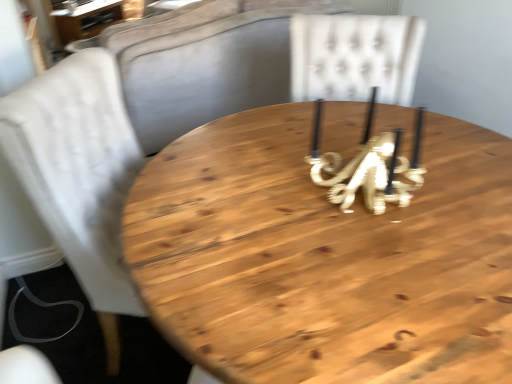
Question: Would you say white fabric chair at left is part of natural wood table at center, which ranks as the 2th table in left-to-right order,'s contents?

Choices:
 (A) no
 (B) yes

Answer: (A)

Question: Considering the relative positions of natural wood table at center, which is the first table from right to left, and white fabric chair at left in the image provided, is natural wood table at center, which is the first table from right to left, behind white fabric chair at left?

Choices:
 (A) no
 (B) yes

Answer: (A)

Question: Does natural wood table at center, arranged as the 2th table when viewed from the back, have a smaller size compared to white fabric chair at left?

Choices:
 (A) yes
 (B) no

Answer: (A)

Question: Considering the relative positions of natural wood table at center, which appears as the 1th table when ordered from the bottom, and white fabric chair at left in the image provided, is natural wood table at center, which appears as the 1th table when ordered from the bottom, to the right of white fabric chair at left from the viewer's perspective?

Choices:
 (A) no
 (B) yes

Answer: (B)

Question: Considering the relative sizes of natural wood table at center, which ranks as the 2th table in left-to-right order, and white fabric chair at left in the image provided, is natural wood table at center, which ranks as the 2th table in left-to-right order, taller than white fabric chair at left?

Choices:
 (A) no
 (B) yes

Answer: (B)

Question: Can we say natural wood table at center, which is the second table in top-to-bottom order, lies outside white fabric chair at left?

Choices:
 (A) no
 (B) yes

Answer: (B)

Question: Is wooden table at upper left, the second table when ordered from right to left, inside white fabric chair at left?

Choices:
 (A) yes
 (B) no

Answer: (B)

Question: Considering the relative sizes of white fabric chair at left and wooden table at upper left, which ranks as the second table in front-to-back order, in the image provided, is white fabric chair at left taller than wooden table at upper left, which ranks as the second table in front-to-back order,?

Choices:
 (A) yes
 (B) no

Answer: (A)

Question: From the image's perspective, is white fabric chair at left located beneath wooden table at upper left, which ranks as the second table in bottom-to-top order?

Choices:
 (A) no
 (B) yes

Answer: (B)

Question: Is white fabric chair at left in front of wooden table at upper left, acting as the 1th table starting from the left?

Choices:
 (A) yes
 (B) no

Answer: (A)

Question: Can you confirm if white fabric chair at left is positioned to the left of wooden table at upper left, which is the 1th table in top-to-bottom order?

Choices:
 (A) no
 (B) yes

Answer: (A)

Question: Considering the relative sizes of white fabric chair at left and wooden table at upper left, which is the 1th table in top-to-bottom order, in the image provided, is white fabric chair at left bigger than wooden table at upper left, which is the 1th table in top-to-bottom order,?

Choices:
 (A) no
 (B) yes

Answer: (B)

Question: Is wooden table at upper left, the second table when ordered from right to left, looking in the opposite direction of white fabric chair at left?

Choices:
 (A) no
 (B) yes

Answer: (A)